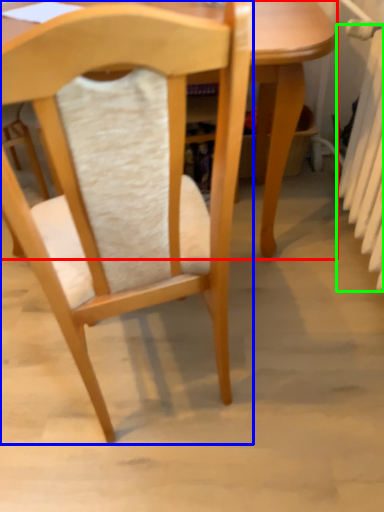
Question: Estimate the real-world distances between objects in this image. Which object is closer to table (highlighted by a red box), chair (highlighted by a blue box) or radiator (highlighted by a green box)?

Choices:
 (A) chair
 (B) radiator

Answer: (B)